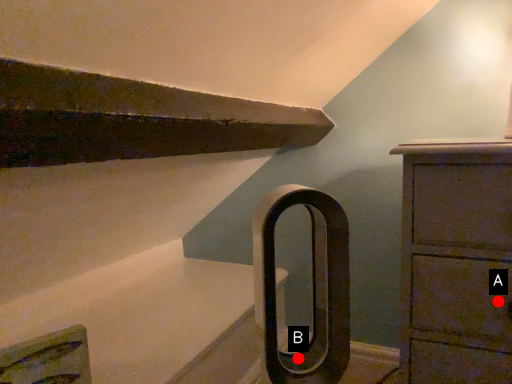
Question: Two points are circled on the image, labeled by A and B beside each circle. Which point is further to the camera?

Choices:
 (A) A is further
 (B) B is further

Answer: (B)